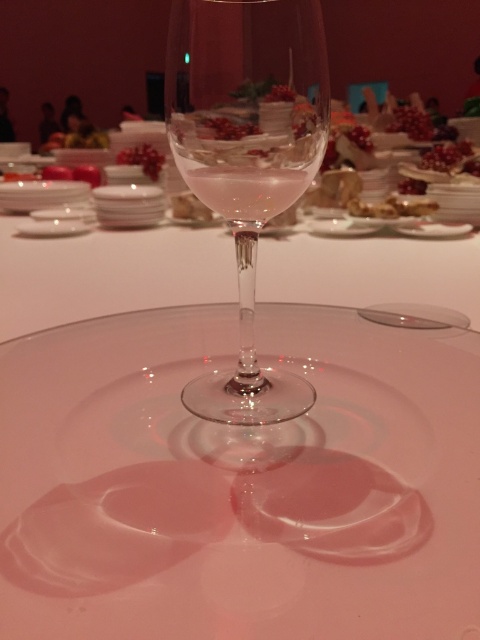
Between point (349, 202) and point (190, 205), which one is positioned behind?

Positioned behind is point (349, 202).

Does matte gold plate at upper center have a lesser height compared to translucent glass at center?

Indeed, matte gold plate at upper center has a lesser height compared to translucent glass at center.

Identify the location of matte gold plate at upper center. This screenshot has height=640, width=480. (393, 205).

Is clear glass wine at center smaller than translucent glass at center?

Indeed, clear glass wine at center has a smaller size compared to translucent glass at center.

Between clear glass wine at center and translucent glass at center, which one is positioned lower?

clear glass wine at center

Which is behind, point (228, 221) or point (189, 205)?

The point (189, 205) is behind.

Identify the location of clear glass wine at center. (245, 193).

Which is behind, point (243, 394) or point (46, 269)?

Point (46, 269)

Does transparent glass wine glass at center lie in front of transparent glass plate at center?

Yes.

Is point (184, 44) positioned before point (466, 269)?

Yes, point (184, 44) is in front of point (466, 269).

Locate an element on the screen. This screenshot has height=640, width=480. transparent glass wine glass at center is located at coordinates (247, 157).